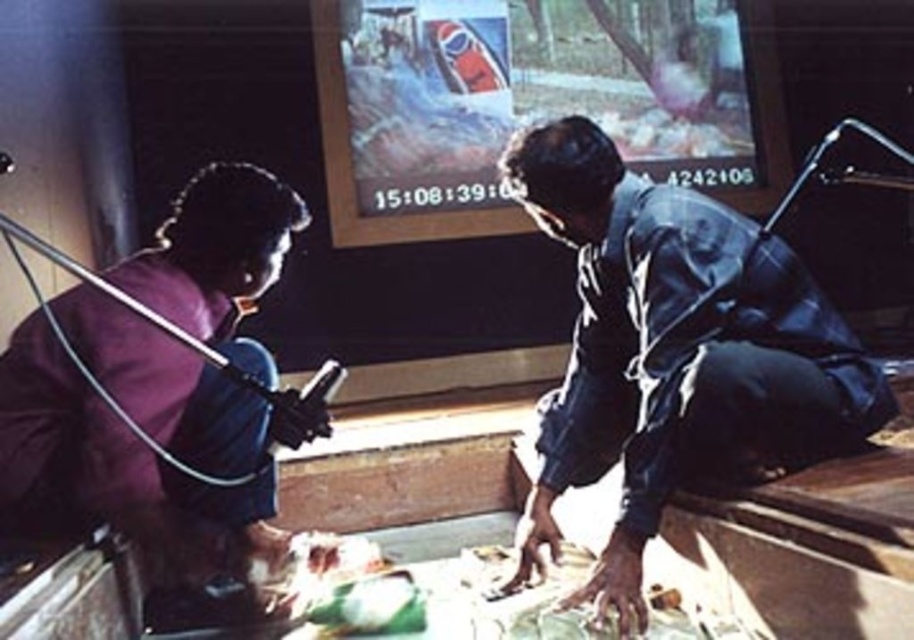
You are a tailor who needs to determine which fabric piece is larger between the dark blue fabric at right and the purple fabric at lower left. Based on the scene, which fabric is larger?

The dark blue fabric at right is bigger than the purple fabric at lower left according to the description provided.

Looking at this image, you are a tailor who needs to decide which fabric to use for a project. You have two options in the image, the dark blue fabric at right and the purple fabric at lower left. Based on their sizes, which one would you choose if you need a larger piece of fabric?

The dark blue fabric at right might be wider than purple fabric at lower left, so you should choose the dark blue fabric at right for the project since it is likely the larger piece.

You are standing in the scene and want to place a small item on the dark blue fabric at right. Based on its position, where exactly should you aim to place the item?

The dark blue fabric at right is located at point (673,353), so you should aim for that coordinate to place the item there.